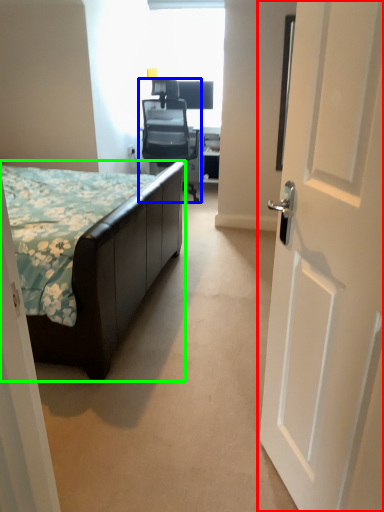
Question: Which is nearer to the door (highlighted by a red box)? chair (highlighted by a blue box) or bed (highlighted by a green box).

Choices:
 (A) chair
 (B) bed

Answer: (B)